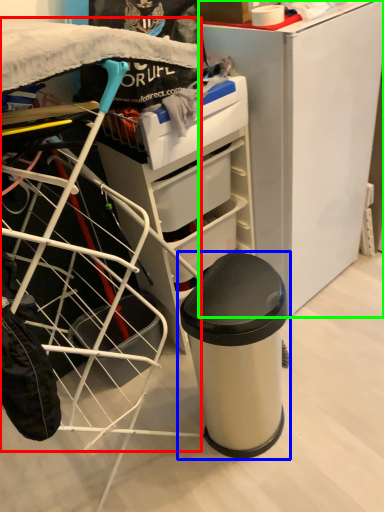
Question: Estimate the real-world distances between objects in this image. Which object is closer to wide (highlighted by a red box), waste container (highlighted by a blue box) or furniture (highlighted by a green box)?

Choices:
 (A) waste container
 (B) furniture

Answer: (A)